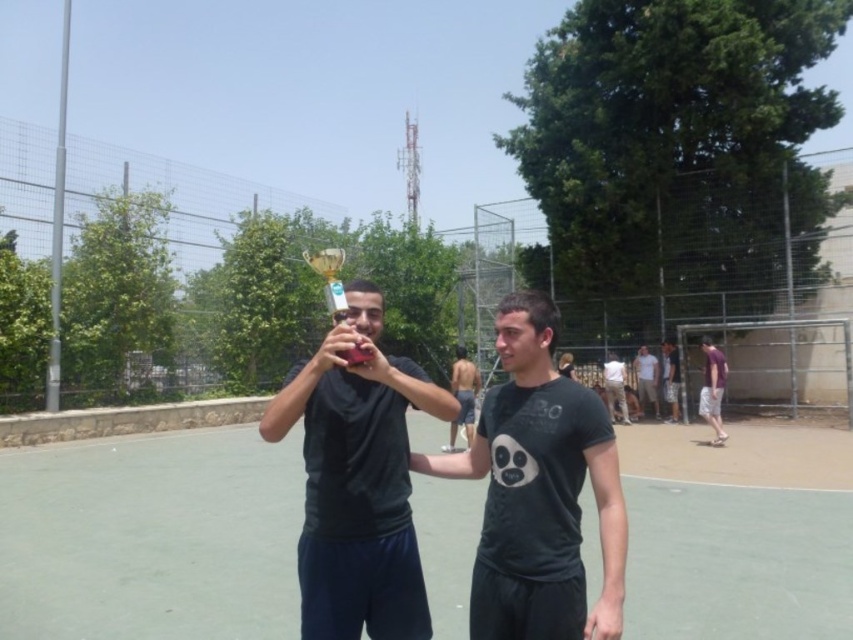
Is point (334, 257) less distant than point (645, 388)?

That is True.

Which is in front, point (323, 264) or point (648, 396)?

Point (323, 264) is more forward.

Where is `gold metallic trophy at upper center`? gold metallic trophy at upper center is located at coordinates (329, 278).

Between matte black trophy at center and purple cotton shorts at right, which one has less height?

Standing shorter between the two is matte black trophy at center.

Is matte black trophy at center to the left of purple cotton shorts at right from the viewer's perspective?

Indeed, matte black trophy at center is positioned on the left side of purple cotton shorts at right.

Does point (379, 401) come farther from viewer compared to point (715, 358)?

No, it is not.

Where is `matte black trophy at center`? This screenshot has height=640, width=853. matte black trophy at center is located at coordinates (357, 499).

Can you confirm if green rubber tennis court at center is positioned above white cotton shirt at center?

Incorrect, green rubber tennis court at center is not positioned above white cotton shirt at center.

What do you see at coordinates (151, 538) in the screenshot?
I see `green rubber tennis court at center` at bounding box center [151, 538].

What do you see at coordinates (151, 538) in the screenshot?
I see `green rubber tennis court at center` at bounding box center [151, 538].

Locate an element on the screen. This screenshot has height=640, width=853. green rubber tennis court at center is located at coordinates (151, 538).